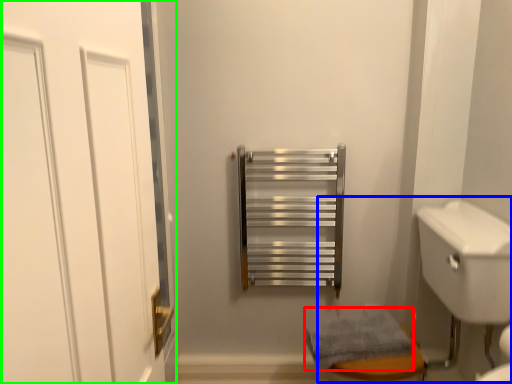
Question: Considering the real-world distances, which object is closest to bath towel (highlighted by a red box)? sink (highlighted by a blue box) or door (highlighted by a green box).

Choices:
 (A) sink
 (B) door

Answer: (A)